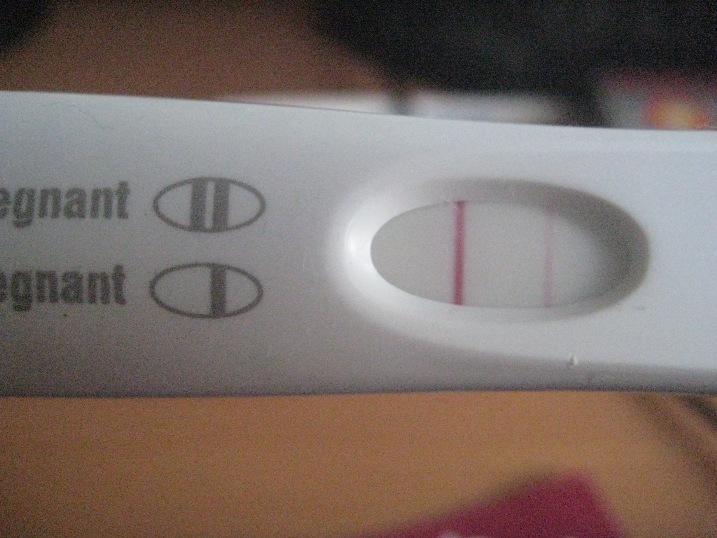
What are the coordinates of `window` in the screenshot? It's located at (434, 244).